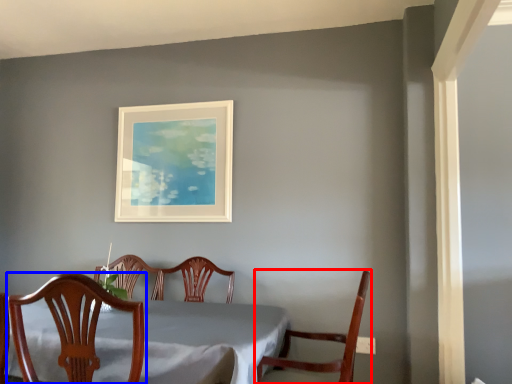
Question: Which object is closer to the camera taking this photo, chair (highlighted by a red box) or chair (highlighted by a blue box)?

Choices:
 (A) chair
 (B) chair

Answer: (B)